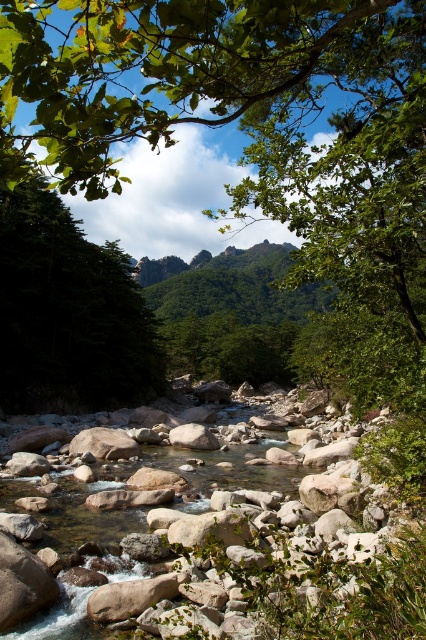
You are a hiker trying to navigate through the riverbed. You notice the green leafy tree at upper center and the green matte tree at left. Which tree would you use as a landmark if you want to find the tallest tree in the area?

The green leafy tree at upper center is much taller than the green matte tree at left, so it would be the better landmark for the tallest tree in the area.

You are standing at the center of the rocky riverbed and want to reach the green leafy tree at upper center. Which direction should you head towards?

The green leafy tree at upper center is located at point [187,72], so you should head towards the upper center direction to reach it.

You are a hiker who wants to cross the river using the rocks. You see the green leafy tree at upper center. How far apart are the rocks you need to step on to reach the tree?

The rocks you need to step on to reach the green leafy tree at upper center are 2.68 meters apart.